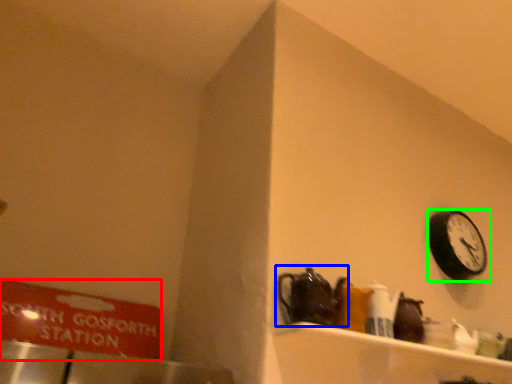
Question: Which is farther away from sign (highlighted by a red box)? tea pot (highlighted by a blue box) or wall clock (highlighted by a green box)?

Choices:
 (A) tea pot
 (B) wall clock

Answer: (B)